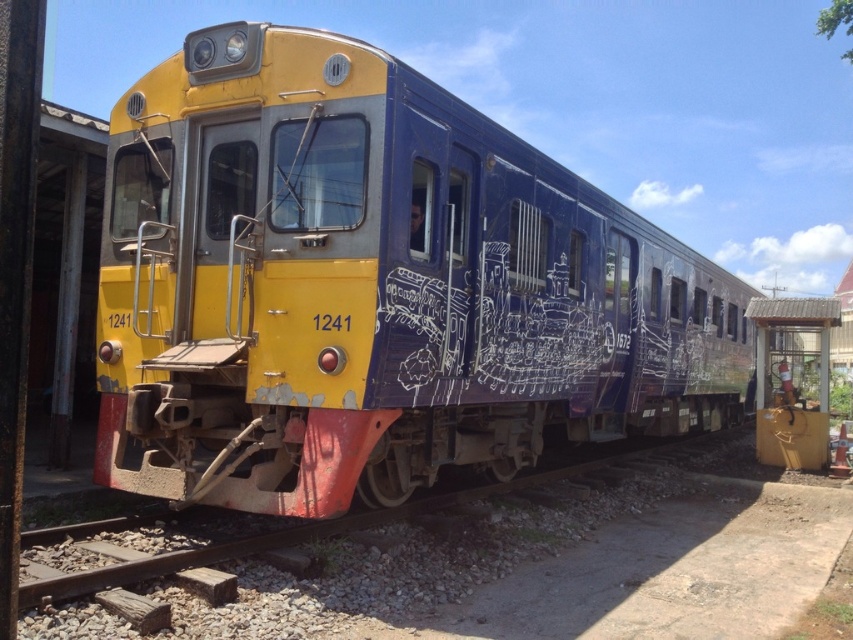
Question: Is the position of yellow matte train at center more distant than that of metal/rough track at lower left?

Choices:
 (A) yes
 (B) no

Answer: (A)

Question: Which point is farther to the camera?

Choices:
 (A) (138, 582)
 (B) (334, 40)

Answer: (B)

Question: Is yellow matte train at center below metal/rough track at lower left?

Choices:
 (A) yes
 (B) no

Answer: (B)

Question: In this image, where is yellow matte train at center located relative to metal/rough track at lower left?

Choices:
 (A) above
 (B) below

Answer: (A)